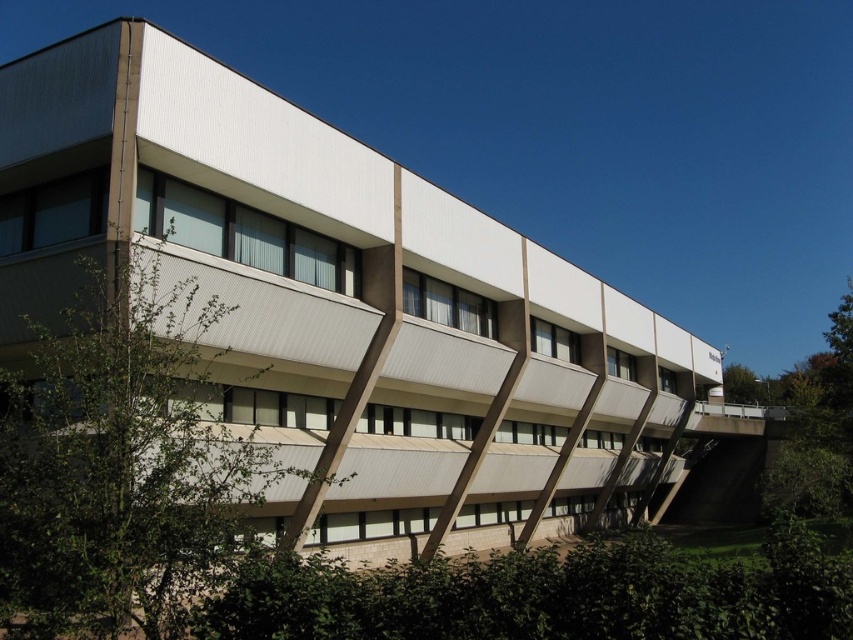
Can you confirm if green leafy tree at right is positioned below green leafy tree at upper right?

No.

Can you confirm if green leafy tree at right is thinner than green leafy tree at upper right?

No, green leafy tree at right is not thinner than green leafy tree at upper right.

Identify the location of green leafy tree at right. This screenshot has height=640, width=853. (816, 428).

Who is shorter, green leafy tree at center or green leafy tree at right?

With less height is green leafy tree at center.

The height and width of the screenshot is (640, 853). In order to click on green leafy tree at center in this screenshot , I will do `click(120, 461)`.

The image size is (853, 640). Find the location of `green leafy tree at center`. green leafy tree at center is located at coordinates (120, 461).

Is green leafy tree at center bigger than green leafy tree at upper right?

Incorrect, green leafy tree at center is not larger than green leafy tree at upper right.

Image resolution: width=853 pixels, height=640 pixels. Find the location of `green leafy tree at center`. green leafy tree at center is located at coordinates (120, 461).

The width and height of the screenshot is (853, 640). Describe the element at coordinates (120, 461) in the screenshot. I see `green leafy tree at center` at that location.

This screenshot has height=640, width=853. I want to click on green leafy tree at center, so click(120, 461).